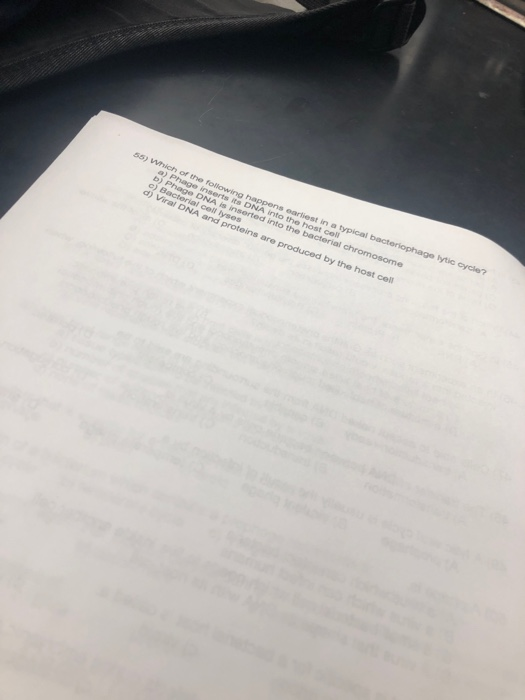
What are the coordinates of `edge of cushion` in the screenshot? It's located at (124, 36).